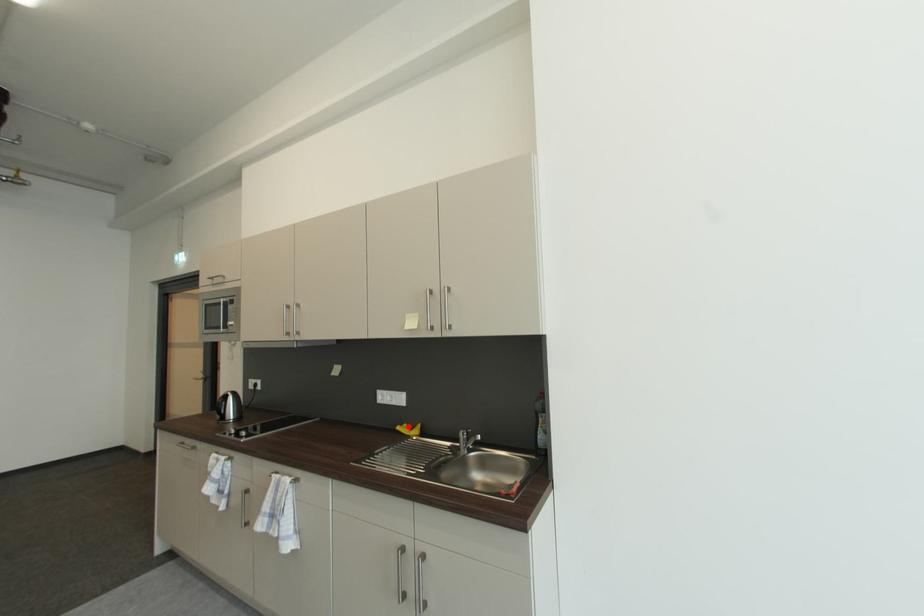
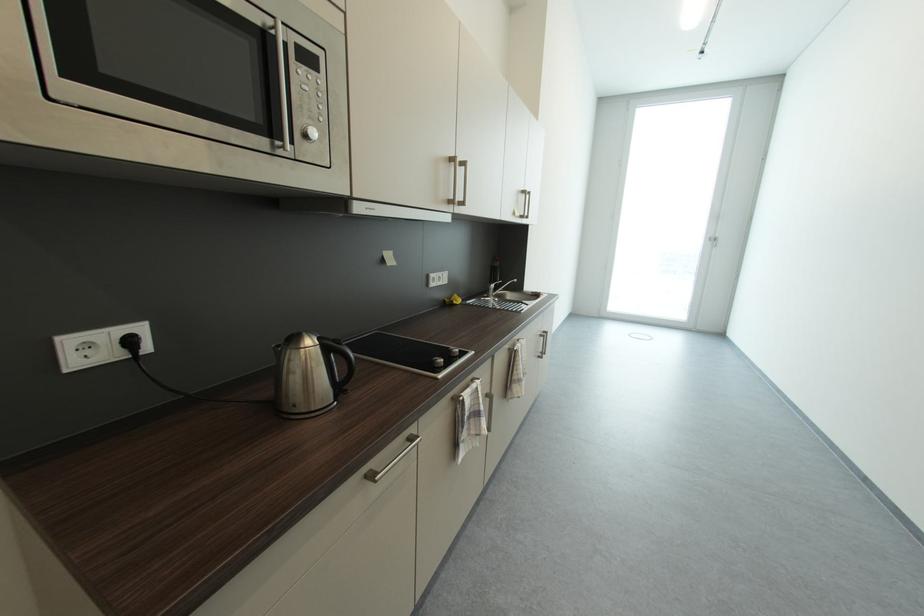
Find the pixel in the second image that matches the highlighted location in the first image.

(453, 302)